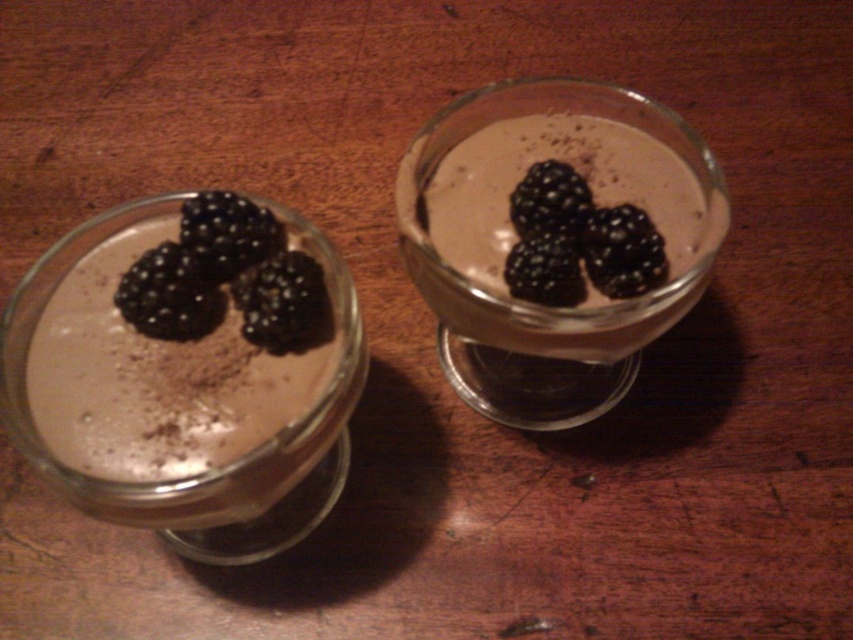
Question: From the image, what is the correct spatial relationship of matte black berry at left in relation to black matte/blackberry at upper right?

Choices:
 (A) above
 (B) below

Answer: (B)

Question: Does black matte/blackberry at upper left have a larger size compared to black matte/blackberry at upper right?

Choices:
 (A) no
 (B) yes

Answer: (A)

Question: Does black matte/blackberry at upper left come behind black matte/blackberry at upper right?

Choices:
 (A) no
 (B) yes

Answer: (A)

Question: Which object appears farthest from the camera in this image?

Choices:
 (A) black matte/blackberry at upper center
 (B) matte chocolate pudding at left

Answer: (A)

Question: Which of these objects is positioned closest to the matte chocolate pudding at left?

Choices:
 (A) matte black berry at left
 (B) black matte/blackberry at upper center
 (C) matte glass dessert at upper center
 (D) black matte/blackberry at upper right

Answer: (A)

Question: Among these points, which one is nearest to the camera?

Choices:
 (A) (206, 292)
 (B) (440, 296)

Answer: (A)